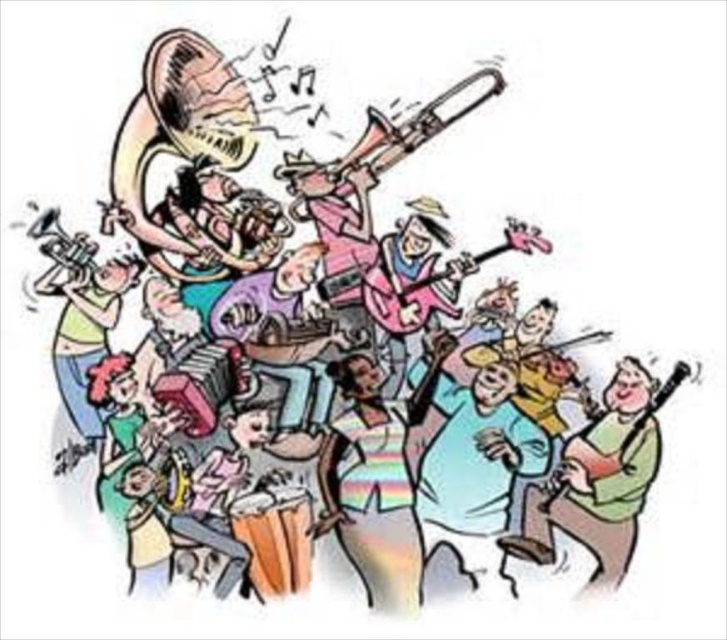
Question: Which point appears farthest from the camera in this image?

Choices:
 (A) (437, 113)
 (B) (366, 275)

Answer: (B)

Question: Which point is farther from the camera taking this photo?

Choices:
 (A) (656, 406)
 (B) (499, 76)

Answer: (B)

Question: Can you confirm if metallic brass trumpet at upper center is positioned to the left of matte black guitar at right?

Choices:
 (A) yes
 (B) no

Answer: (A)

Question: From the image, what is the correct spatial relationship of pink matte guitar at center in relation to matte black guitar at right?

Choices:
 (A) left
 (B) right

Answer: (A)

Question: Which point is closer to the camera?

Choices:
 (A) (530, 234)
 (B) (642, 416)
 (C) (403, 136)

Answer: (B)

Question: Is metallic brass trumpet at upper center wider than matte black guitar at right?

Choices:
 (A) yes
 (B) no

Answer: (A)